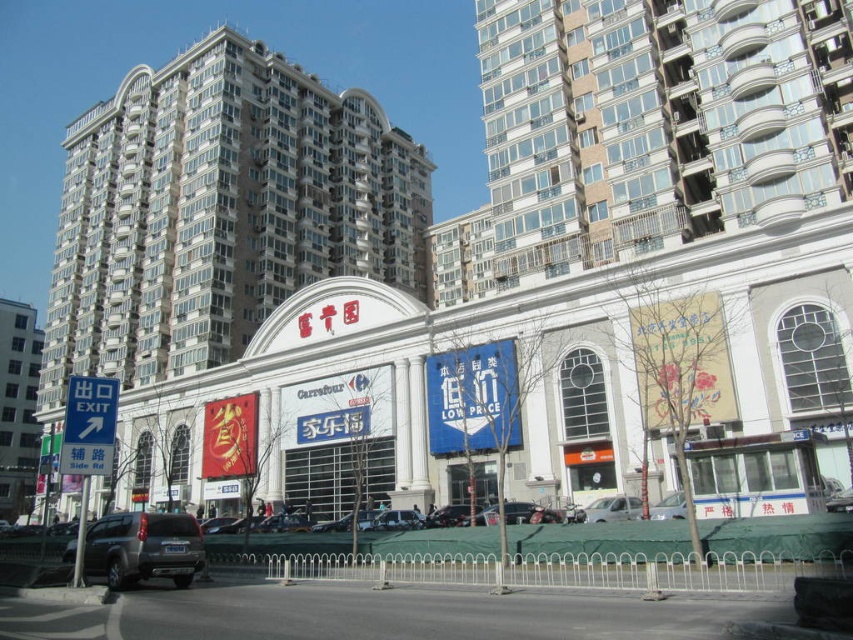
This screenshot has width=853, height=640. Describe the element at coordinates (143, 548) in the screenshot. I see `dark gray matte suv at lower left` at that location.

Does point (96, 547) come in front of point (410, 522)?

Yes.

Does point (180, 586) come closer to viewer compared to point (405, 513)?

That is True.

In order to click on dark gray matte suv at lower left in this screenshot , I will do `click(143, 548)`.

Does white glossy building at center have a lesser width compared to metallic silver car at center?

Incorrect, white glossy building at center's width is not less than metallic silver car at center's.

Can you confirm if white glossy building at center is smaller than metallic silver car at center?

No, white glossy building at center is not smaller than metallic silver car at center.

Who is more distant from viewer, (310, 204) or (477, 518)?

Point (310, 204)

This screenshot has width=853, height=640. I want to click on white glossy building at center, so click(219, 211).

Who is positioned more to the left, white glossy building at center or dark gray matte suv at lower left?

white glossy building at center is more to the left.

Can you confirm if white glossy building at center is taller than dark gray matte suv at lower left?

Yes, white glossy building at center is taller than dark gray matte suv at lower left.

Where is `white glossy building at center`? This screenshot has height=640, width=853. white glossy building at center is located at coordinates (219, 211).